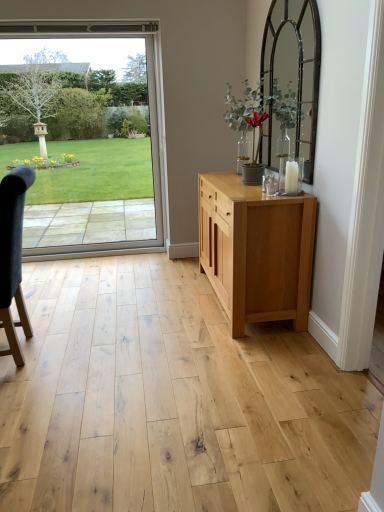
What do you see at coordinates (13, 256) in the screenshot? Image resolution: width=384 pixels, height=512 pixels. I see `dark gray fabric chair at left` at bounding box center [13, 256].

Identify the location of clear glass door at left. The width and height of the screenshot is (384, 512). (83, 135).

Locate an element on the screen. dark gray fabric chair at left is located at coordinates (13, 256).

Where is `chair lying on the left of natural wood cabinet at center`? The width and height of the screenshot is (384, 512). chair lying on the left of natural wood cabinet at center is located at coordinates (13, 256).

From the picture: Which object is wider, dark gray fabric chair at left or natural wood cabinet at center?

With larger width is natural wood cabinet at center.

From a real-world perspective, which object rests below the other?

In real-world perspective, dark gray fabric chair at left is lower.

Which of these two, clear glass door at left or dark gray fabric chair at left, is bigger?

With larger size is dark gray fabric chair at left.

Which of these two, clear glass door at left or dark gray fabric chair at left, stands shorter?

dark gray fabric chair at left.

Is natural wood cabinet at center far from dark gray fabric chair at left?

Indeed, natural wood cabinet at center is not near dark gray fabric chair at left.

Between natural wood cabinet at center and dark gray fabric chair at left, which one is positioned in front?

dark gray fabric chair at left.

The height and width of the screenshot is (512, 384). I want to click on chest of drawers that appears on the right of dark gray fabric chair at left, so click(x=256, y=250).

What are the coordinates of `chest of drawers below the clear glass door at left (from a real-world perspective)` in the screenshot? It's located at (256, 250).

From the picture: How far apart are clear glass door at left and natural wood cabinet at center?

They are 5.04 feet apart.

Is clear glass door at left facing towards natural wood cabinet at center?

No, clear glass door at left is not aimed at natural wood cabinet at center.

Based on the photo, from the image's perspective, is clear glass door at left under natural wood cabinet at center?

Incorrect, from the image's perspective, clear glass door at left is higher than natural wood cabinet at center.

Considering the relative sizes of dark gray fabric chair at left and clear glass door at left in the image provided, is dark gray fabric chair at left thinner than clear glass door at left?

Incorrect, the width of dark gray fabric chair at left is not less than that of clear glass door at left.

Which of these two, dark gray fabric chair at left or clear glass door at left, stands shorter?

dark gray fabric chair at left.

Who is smaller, dark gray fabric chair at left or clear glass door at left?

clear glass door at left.

Are dark gray fabric chair at left and clear glass door at left located far from each other?

Yes, dark gray fabric chair at left and clear glass door at left are quite far apart.

From the image's perspective, which is above, natural wood cabinet at center or clear glass door at left?

clear glass door at left is shown above in the image.

Can you confirm if natural wood cabinet at center is taller than clear glass door at left?

In fact, natural wood cabinet at center may be shorter than clear glass door at left.

Is clear glass door at left a part of natural wood cabinet at center?

No, clear glass door at left is located outside of natural wood cabinet at center.

Is natural wood cabinet at center turned away from clear glass door at left?

natural wood cabinet at center does not have its back to clear glass door at left.

Image resolution: width=384 pixels, height=512 pixels. Identify the location of chair on the left of natural wood cabinet at center. (13, 256).

Locate an element on the screen. This screenshot has height=512, width=384. chair on the right of the clear glass door at left is located at coordinates (13, 256).

Looking at the image, which one is located closer to clear glass door at left, natural wood cabinet at center or dark gray fabric chair at left?

Among the two, natural wood cabinet at center is located nearer to clear glass door at left.

Looking at the image, which one is located closer to dark gray fabric chair at left, clear glass door at left or natural wood cabinet at center?

natural wood cabinet at center is closer to dark gray fabric chair at left.

Based on their spatial positions, is natural wood cabinet at center or clear glass door at left closer to dark gray fabric chair at left?

natural wood cabinet at center lies closer to dark gray fabric chair at left than the other object.

When comparing their distances from natural wood cabinet at center, does dark gray fabric chair at left or clear glass door at left seem closer?

Based on the image, dark gray fabric chair at left appears to be nearer to natural wood cabinet at center.

Considering their positions, is dark gray fabric chair at left positioned closer to clear glass door at left than natural wood cabinet at center?

Based on the image, natural wood cabinet at center appears to be nearer to clear glass door at left.

Considering their positions, is clear glass door at left positioned further to natural wood cabinet at center than dark gray fabric chair at left?

clear glass door at left is further to natural wood cabinet at center.

Identify the location of chair between clear glass door at left and natural wood cabinet at center in the horizontal direction. This screenshot has width=384, height=512. (13, 256).